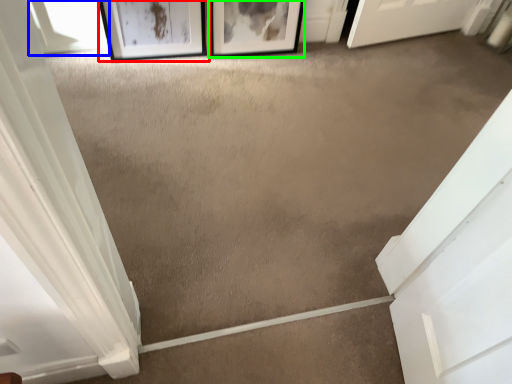
Question: Which object is the farthest from picture frame (highlighted by a red box)? Choose among these: window (highlighted by a blue box) or picture frame (highlighted by a green box).

Choices:
 (A) window
 (B) picture frame

Answer: (B)